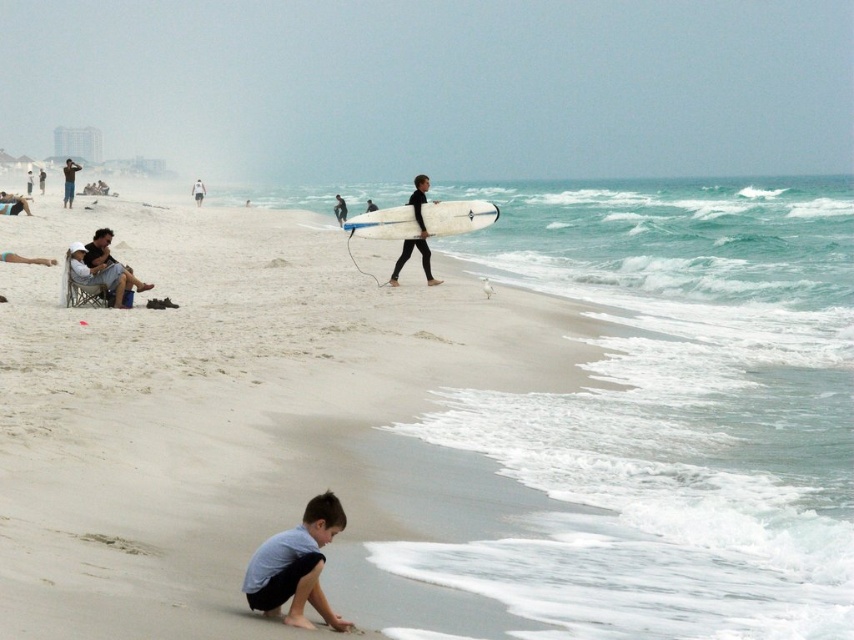
You are standing on the beach and see the white sand at center and the light blue cotton shirt at lower center. Which object is taller?

The white sand at center is taller than the light blue cotton shirt at lower center.